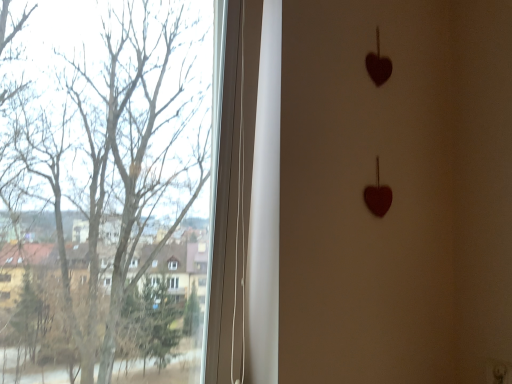
Where is `transparent glass tree at left`? transparent glass tree at left is located at coordinates (109, 175).

This screenshot has width=512, height=384. What do you see at coordinates (109, 175) in the screenshot?
I see `transparent glass tree at left` at bounding box center [109, 175].

This screenshot has height=384, width=512. I want to click on transparent glass tree at left, so click(109, 175).